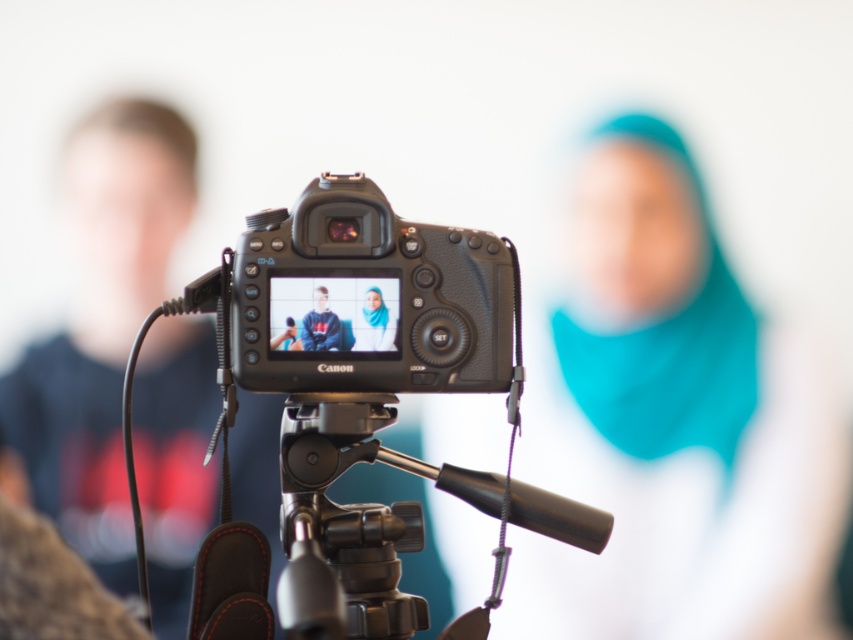
You are a photographer adjusting the Canon DSLR camera setup. You need to ensure that both the matte blue scarf at center and the matte black hoodie at center are clearly visible in the photo. Which object should you focus on to ensure both are in focus?

You should focus on the matte black hoodie at center because it is farther away from the camera than the matte blue scarf at center. By focusing on the farther object, the depth of field may allow both to be in focus.